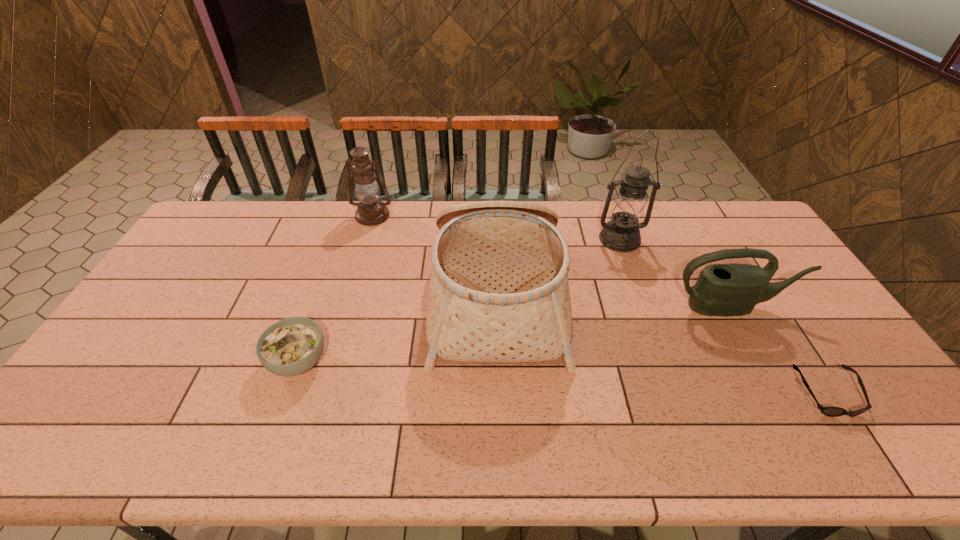
I want to click on the nearer oil lamp, so click(628, 207).

At what (x,y) coordinates should I click in order to perform the action: click on the tallest object. Please return your answer as a coordinate pair (x, y). This screenshot has width=960, height=540. Looking at the image, I should click on (628, 207).

Find the location of a particular element. the third object from left to right is located at coordinates (499, 292).

This screenshot has width=960, height=540. What are the coordinates of `the farther oil lamp` in the screenshot? It's located at (371, 211).

At what (x,y) coordinates should I click in order to perform the action: click on the shorter oil lamp. Please return your answer as a coordinate pair (x, y). Looking at the image, I should click on (371, 211).

This screenshot has height=540, width=960. Find the location of `watering can`. watering can is located at coordinates (730, 289).

What are the coordinates of `soup bowl` in the screenshot? It's located at (292, 346).

The width and height of the screenshot is (960, 540). What are the coordinates of `the shortest object` in the screenshot? It's located at (828, 411).

Identify the location of free space located on the back of the nearer oil lamp. (610, 211).

Locate an element on the screen. The image size is (960, 540). free space located with the lid open on the fourth object from right to left is located at coordinates (337, 296).